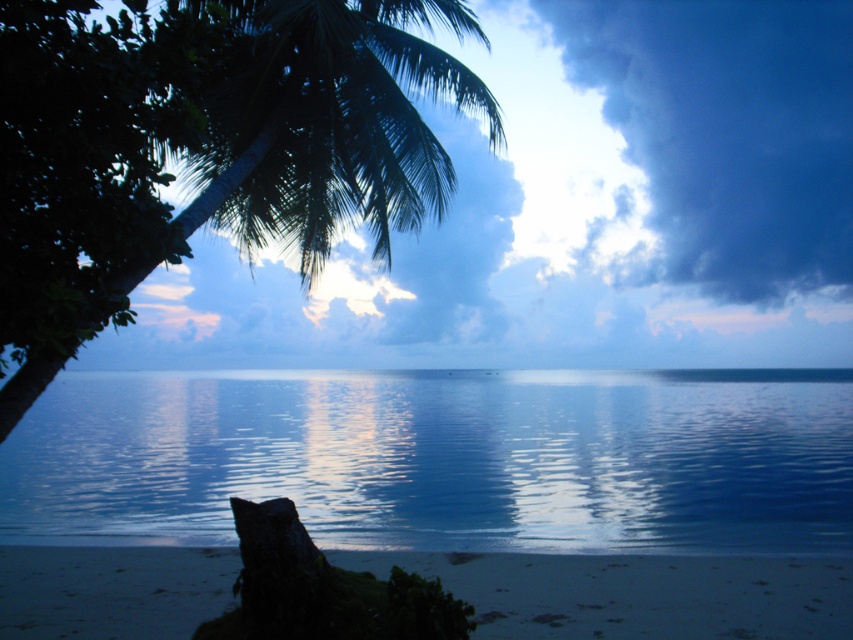
Which is in front, point (320, 186) or point (625, 621)?

Point (625, 621) is in front.

Is point (403, 161) behind point (840, 614)?

Yes, it is.

You are a GUI agent. You are given a task and a screenshot of the screen. Output one action in this format:
    pyautogui.click(x=<x>, y=<y>)
    Task: Click on the green leafy palm at upper left
    This screenshot has height=640, width=853.
    Given the screenshot: What is the action you would take?
    pyautogui.click(x=268, y=157)

Measure the distance between smooth blue water at center and sandy beach at lower center.

8.22 meters

Who is lower down, smooth blue water at center or sandy beach at lower center?

sandy beach at lower center is below.

Who is more forward, (286, 385) or (715, 593)?

Point (715, 593) is more forward.

In order to click on smooth blue water at center in this screenshot , I will do `click(442, 458)`.

Who is more distant from viewer, (544,493) or (410,74)?

The point (544,493) is behind.

Does smooth blue water at center have a greater height compared to green leafy palm at upper left?

Yes, smooth blue water at center is taller than green leafy palm at upper left.

Between point (413, 547) and point (311, 116), which one is positioned behind?

The point (413, 547) is behind.

Locate an element on the screen. The height and width of the screenshot is (640, 853). smooth blue water at center is located at coordinates (442, 458).